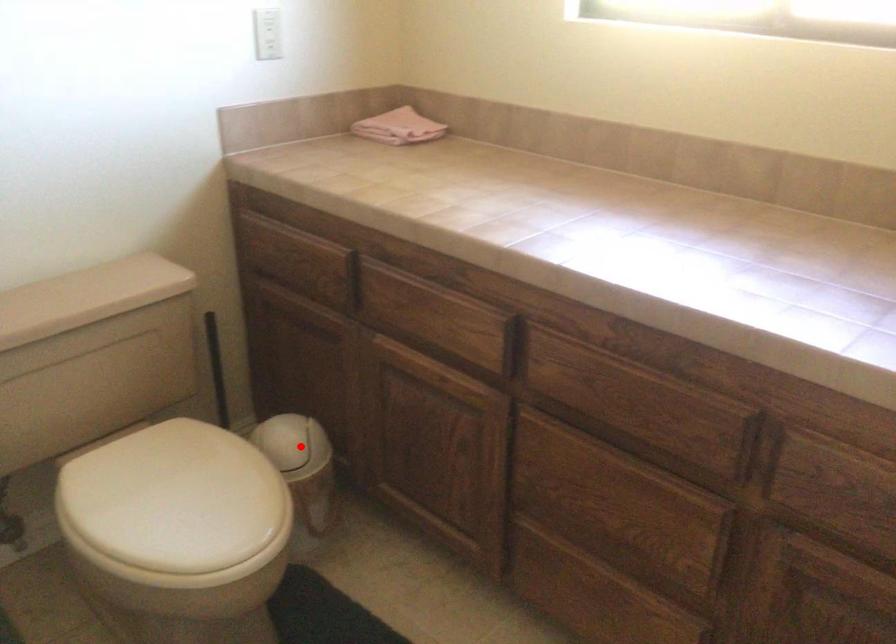
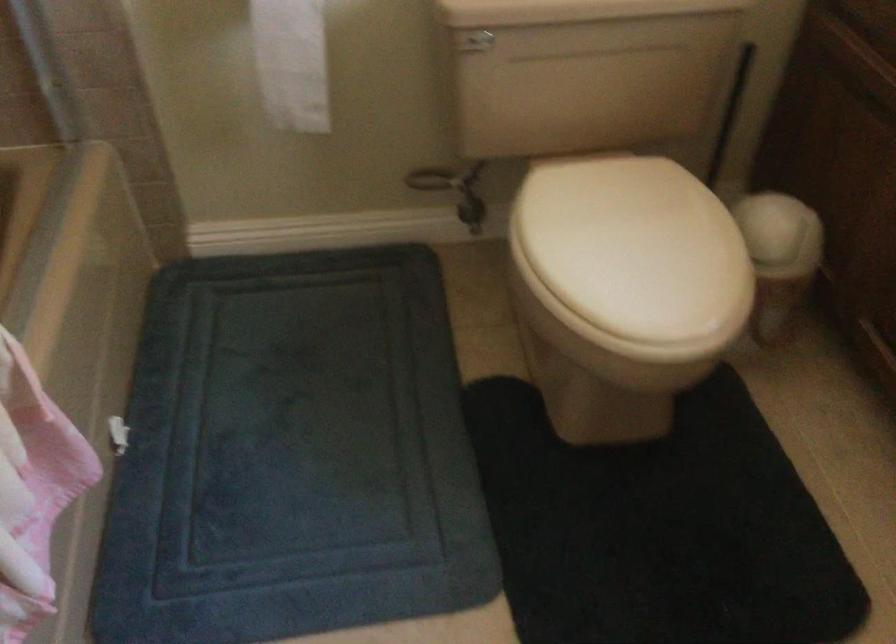
Find the pixel in the second image that matches the highlighted location in the first image.

(780, 234)